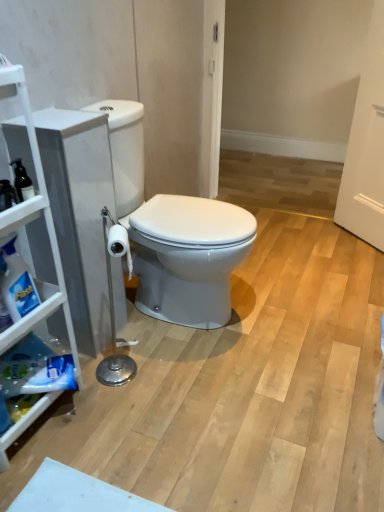
Question: From a real-world perspective, relative to white glossy toilet at center, is white matte cabinet at left vertically above or below?

Choices:
 (A) above
 (B) below

Answer: (A)

Question: Is point (4, 71) closer or farther from the camera than point (241, 233)?

Choices:
 (A) farther
 (B) closer

Answer: (B)

Question: Which object is the closest to the white matte cabinet at left?

Choices:
 (A) white glossy toilet at center
 (B) translucent plastic spray bottle at left

Answer: (B)

Question: Which object is the farthest from the white matte cabinet at left?

Choices:
 (A) white glossy toilet at center
 (B) translucent plastic spray bottle at left

Answer: (A)